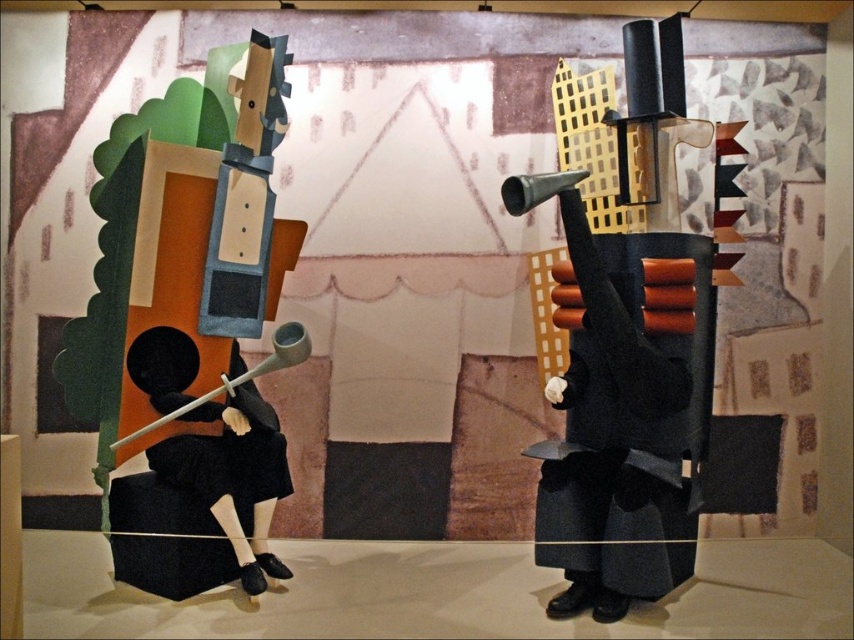
Can you confirm if matte black violin at left is taller than matte black coat at right?

Yes.

Based on the photo, is matte black violin at left bigger than matte black coat at right?

Result: Yes, matte black violin at left is bigger than matte black coat at right.

Find the location of a particular element. The height and width of the screenshot is (640, 854). matte black violin at left is located at coordinates (189, 326).

The image size is (854, 640). Identify the location of matte black violin at left. (189, 326).

Does point (577, 449) come in front of point (258, 456)?

Yes, it is.

What do you see at coordinates (604, 429) in the screenshot? I see `matte black coat at right` at bounding box center [604, 429].

Does point (589, 358) come farther from viewer compared to point (220, 417)?

No, (589, 358) is closer to viewer.

Identify the location of matte black coat at right. The width and height of the screenshot is (854, 640). (604, 429).

Is matte black violin at left positioned behind black matte figure at left?

No, matte black violin at left is in front of black matte figure at left.

Does matte black violin at left have a smaller size compared to black matte figure at left?

No.

Does point (165, 390) come closer to viewer compared to point (285, 490)?

Yes, it is.

Find the location of a particular element. matte black violin at left is located at coordinates (189, 326).